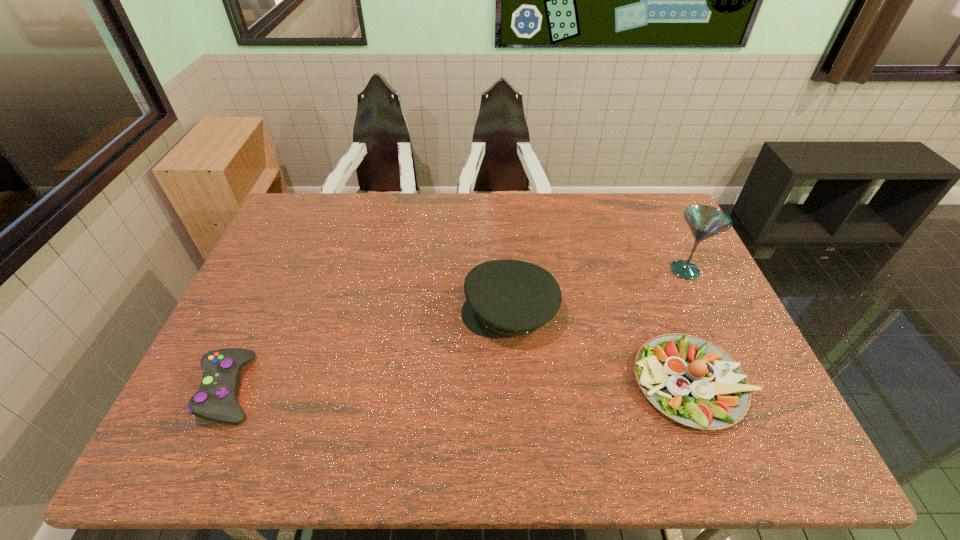
Locate an element on the screen. The width and height of the screenshot is (960, 540). free spot located 0.220m on the left of the salad plate is located at coordinates (543, 383).

This screenshot has height=540, width=960. I want to click on vacant area located 0.350m on the right of the control, so pyautogui.click(x=404, y=388).

In order to click on salad plate that is at the near edge in this screenshot , I will do `click(690, 380)`.

Locate an element on the screen. control that is at the near edge is located at coordinates (215, 400).

Identify the location of object present at the left edge. The image size is (960, 540). (215, 400).

You are a GUI agent. You are given a task and a screenshot of the screen. Output one action in this format:
    pyautogui.click(x=<x>, y=<y>)
    Task: Click on the martini situated at the right edge
    This screenshot has width=960, height=540.
    Given the screenshot: What is the action you would take?
    pyautogui.click(x=704, y=221)

Locate an element on the screen. This screenshot has height=540, width=960. salad plate situated at the right edge is located at coordinates (690, 380).

Find the location of a particular element. The image size is (960, 540). object that is at the near left corner is located at coordinates (215, 400).

Image resolution: width=960 pixels, height=540 pixels. I want to click on object positioned at the near right corner, so click(x=690, y=380).

Locate an element on the screen. This screenshot has width=960, height=540. free location at the far edge is located at coordinates (382, 194).